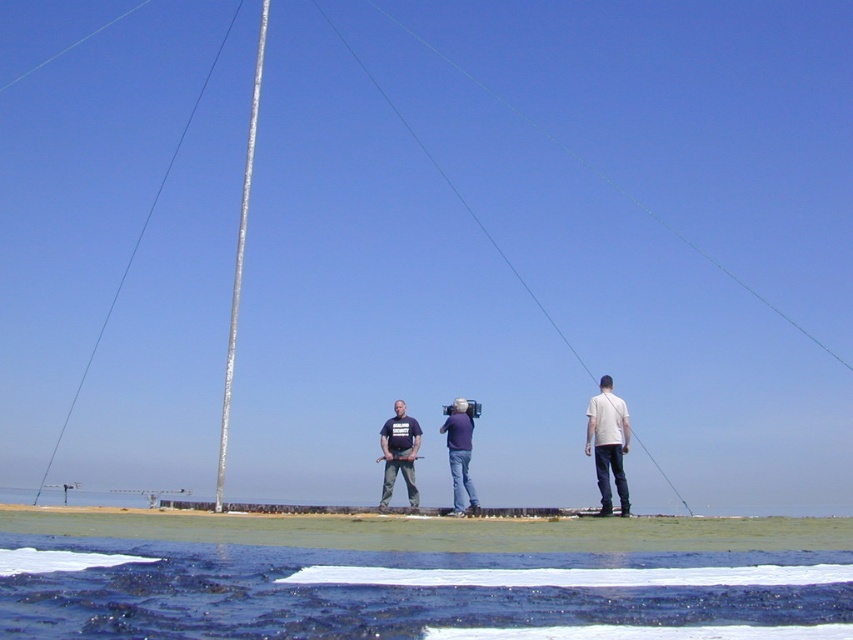
Can you confirm if dark blue water at lower center is wider than dark blue t-shirt at center?

Yes, dark blue water at lower center is wider than dark blue t-shirt at center.

Locate an element on the screen. dark blue water at lower center is located at coordinates (412, 593).

Identify the location of dark blue water at lower center. (412, 593).

Does point (222, 490) come farther from viewer compared to point (448, 433)?

No, it is not.

Is point (215, 481) closer to viewer compared to point (468, 461)?

No, it is not.

Between point (224, 381) and point (467, 451), which one is positioned in front?

Positioned in front is point (467, 451).

Image resolution: width=853 pixels, height=640 pixels. Identify the location of silver reflective mast at center. (239, 259).

Which is more to the right, white matte shirt at center or purple fabric camera at center?

Positioned to the right is white matte shirt at center.

Is point (589, 440) positioned before point (442, 422)?

Yes, it is in front of point (442, 422).

The height and width of the screenshot is (640, 853). Identify the location of white matte shirt at center. (608, 444).